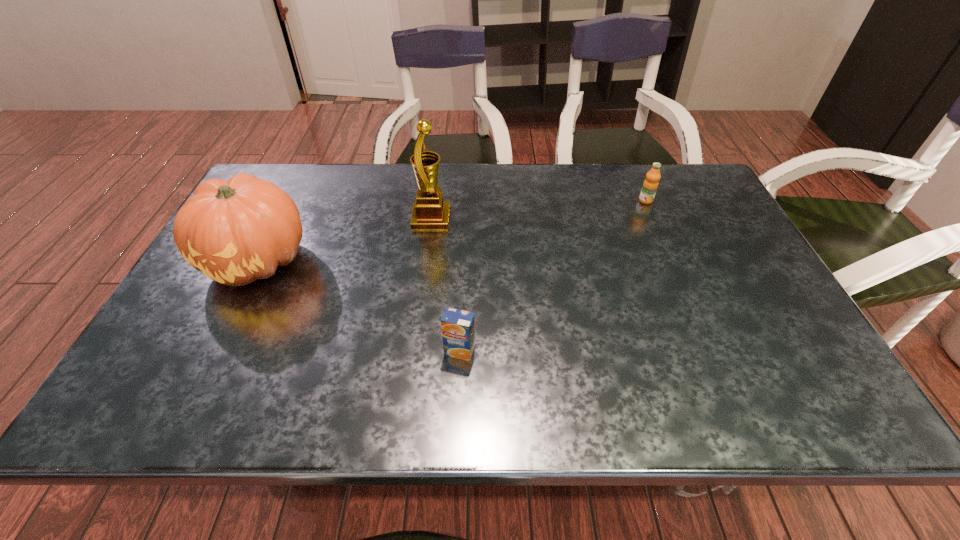
Locate an element on the screen. The width and height of the screenshot is (960, 540). vacant region located on the label of the rightmost object is located at coordinates (668, 252).

The width and height of the screenshot is (960, 540). In order to click on vacant space located on the back of the second object from right to left in this screenshot , I will do `click(464, 233)`.

Find the location of a particular element. award that is at the far edge is located at coordinates (430, 212).

This screenshot has width=960, height=540. In order to click on orange juice that is at the far edge in this screenshot , I will do `click(650, 185)`.

I want to click on object present at the left edge, so click(x=235, y=231).

Identify the location of free space at the far edge of the desktop. (631, 184).

This screenshot has width=960, height=540. In order to click on vacant space at the near edge of the desktop in this screenshot , I will do `click(501, 413)`.

Find the location of a particular element. Image resolution: width=960 pixels, height=540 pixels. blank area at the left edge is located at coordinates (234, 313).

Where is `free space at the right edge`? Image resolution: width=960 pixels, height=540 pixels. free space at the right edge is located at coordinates (823, 376).

In the image, there is a desktop. Identify the location of free space at the far left corner. (304, 184).